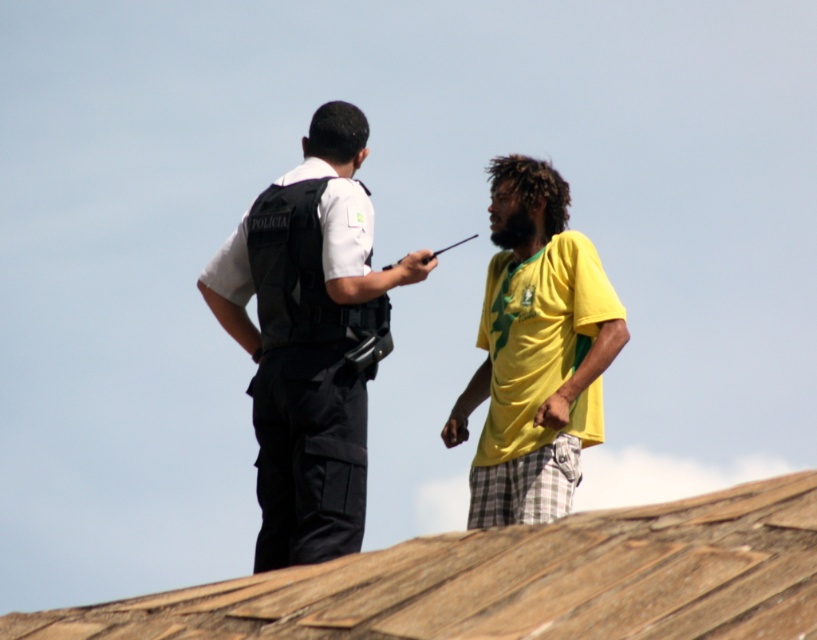
Who is positioned more to the right, brown wooden roof at upper center or yellow-green fabric shirt at center-right?

From the viewer's perspective, yellow-green fabric shirt at center-right appears more on the right side.

Who is shorter, brown wooden roof at upper center or yellow-green fabric shirt at center-right?

brown wooden roof at upper center

Does point (751, 486) come closer to viewer compared to point (599, 419)?

Yes, it is in front of point (599, 419).

Image resolution: width=817 pixels, height=640 pixels. What are the coordinates of `brown wooden roof at upper center` in the screenshot? It's located at (516, 580).

Is black uniformed officer at left positioned in front of yellow-green fabric shirt at center-right?

Yes, black uniformed officer at left is closer to the viewer.

Is black uniformed officer at left taller than yellow-green fabric shirt at center-right?

Correct, black uniformed officer at left is much taller as yellow-green fabric shirt at center-right.

Measure the distance between black uniformed officer at left and camera.

They are 55.29 meters apart.

In order to click on black uniformed officer at left in this screenshot , I will do `click(307, 339)`.

Who is more distant from viewer, (451, 577) or (311, 368)?

The point (311, 368) is behind.

Does brown wooden roof at upper center have a lesser height compared to black uniformed officer at left?

Yes, brown wooden roof at upper center is shorter than black uniformed officer at left.

Is point (664, 625) positioned before point (284, 253)?

Yes, it is.

You are a GUI agent. You are given a task and a screenshot of the screen. Output one action in this format:
    pyautogui.click(x=<x>, y=<y>)
    Task: Click on the brown wooden roof at upper center
    This screenshot has width=817, height=640.
    Given the screenshot: What is the action you would take?
    pyautogui.click(x=516, y=580)